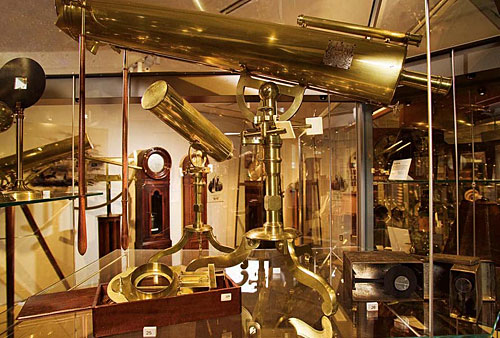
The width and height of the screenshot is (500, 338). Find the location of `stand`. stand is located at coordinates (325, 296), (272, 232), (239, 256).